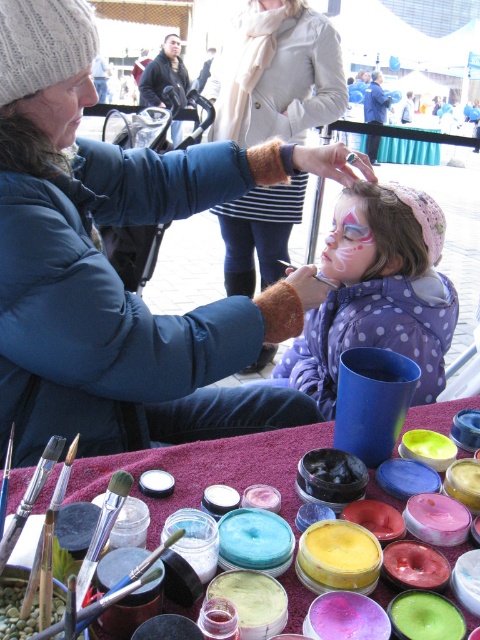
Between maroon fabric at lower center and black bristle paintbrush at upper center, which one appears on the right side from the viewer's perspective?

maroon fabric at lower center

Is maroon fabric at lower center below black bristle paintbrush at upper center?

Correct, maroon fabric at lower center is located below black bristle paintbrush at upper center.

Where is `maroon fabric at lower center`? This screenshot has width=480, height=640. maroon fabric at lower center is located at coordinates (207, 468).

Can you confirm if matte black jacket at center is wider than black bristle paintbrush at upper center?

Indeed, matte black jacket at center has a greater width compared to black bristle paintbrush at upper center.

Can you confirm if matte black jacket at center is positioned below black bristle paintbrush at upper center?

No.

Where is `matte black jacket at center`? This screenshot has width=480, height=640. matte black jacket at center is located at coordinates (277, 74).

In the scene shown: Measure the distance from pastel dotted jacket at center to black bristle paintbrush at upper center.

pastel dotted jacket at center is 8.47 inches from black bristle paintbrush at upper center.

Which is in front, point (408, 193) or point (284, 266)?

Point (408, 193) is more forward.

Image resolution: width=480 pixels, height=640 pixels. What do you see at coordinates (377, 292) in the screenshot? I see `pastel dotted jacket at center` at bounding box center [377, 292].

At what (x,y) coordinates should I click in order to perform the action: click on pastel dotted jacket at center. Please return your answer as a coordinate pair (x, y). The image size is (480, 640). Looking at the image, I should click on (377, 292).